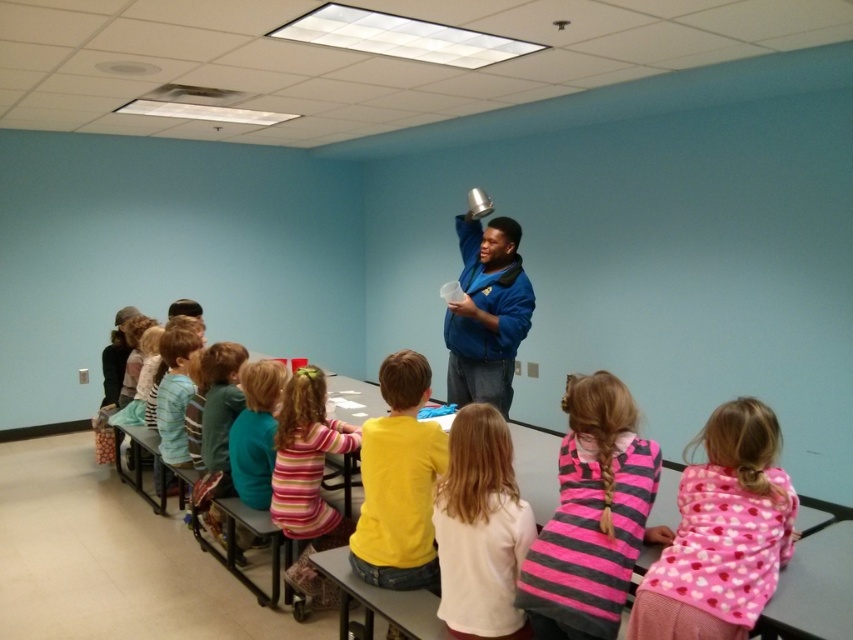
Question: Is the position of pink striped sweater at center less distant than that of striped fabric dress at center?

Choices:
 (A) no
 (B) yes

Answer: (B)

Question: Can you confirm if pink striped sweater at center is positioned to the right of white matte shirt at center?

Choices:
 (A) no
 (B) yes

Answer: (B)

Question: Based on their relative distances, which object is farther from the pink striped sweater at center?

Choices:
 (A) white matte shirt at center
 (B) blue fleece jacket at center
 (C) striped fabric dress at center
 (D) yellow matte shirt at center

Answer: (B)

Question: Is white matte shirt at center to the left of striped fabric dress at center from the viewer's perspective?

Choices:
 (A) no
 (B) yes

Answer: (A)

Question: Which point is farther to the camera?

Choices:
 (A) (589, 472)
 (B) (695, 636)
 (C) (460, 438)
 (D) (294, 380)

Answer: (D)

Question: Which point is farther from the camera taking this photo?

Choices:
 (A) (317, 522)
 (B) (509, 545)

Answer: (A)